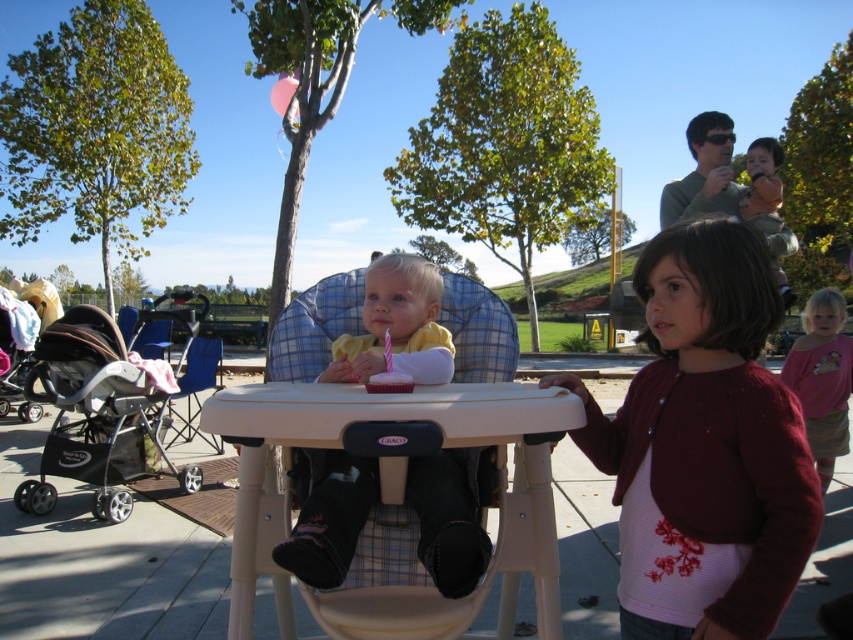
You are attending a birthday party at a park and see two guests wearing the matte yellow shirt at center and the orange cotton shirt at upper right. Which guest is wearing a smaller sized shirt?

The matte yellow shirt at center has a smaller size compared to the orange cotton shirt at upper right, so the guest wearing the matte yellow shirt at center is wearing the smaller sized one.

You are a photographer at a birthday party and need to position two guests wearing the matte yellow shirt at center and the orange cotton shirt at upper right. The minimum distance required between them for a perfect shot is 5 feet. Can they stand closer than the required distance?

The matte yellow shirt at center is 4.42 feet from orange cotton shirt at upper right. Since 4.42 feet is less than 5 feet, they can stand closer than the required distance for the perfect shot.